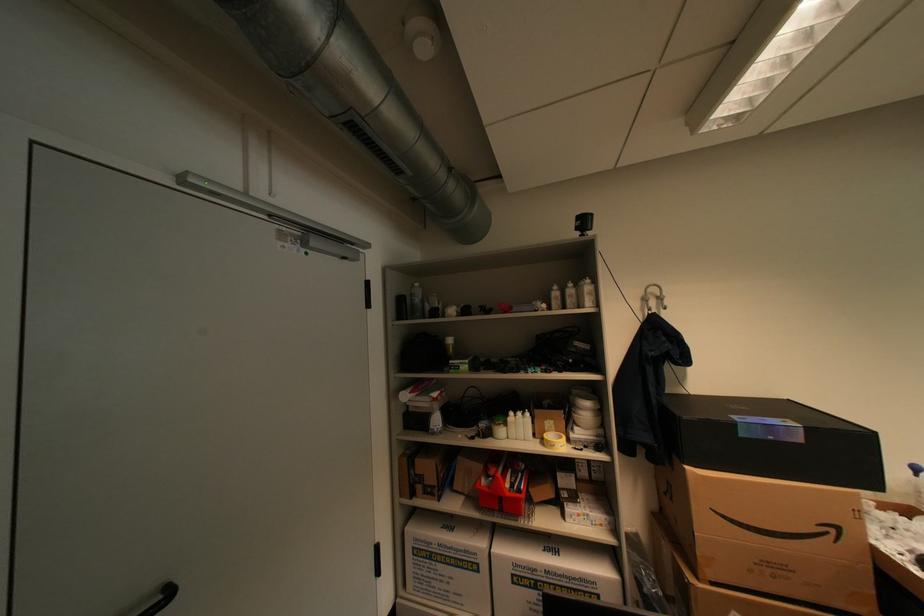
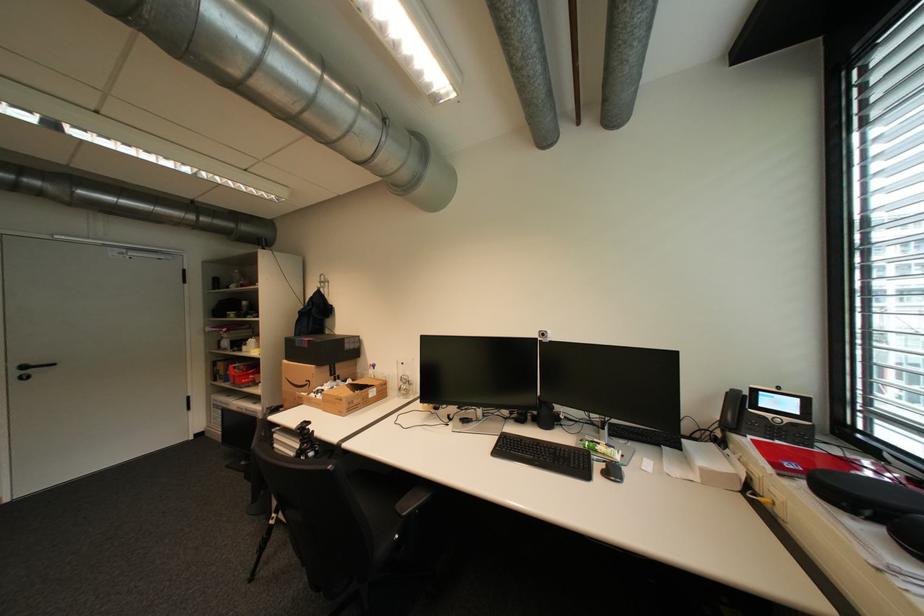
Locate, in the second image, the point that corresponds to pixel 841 531 in the first image.

(317, 383)